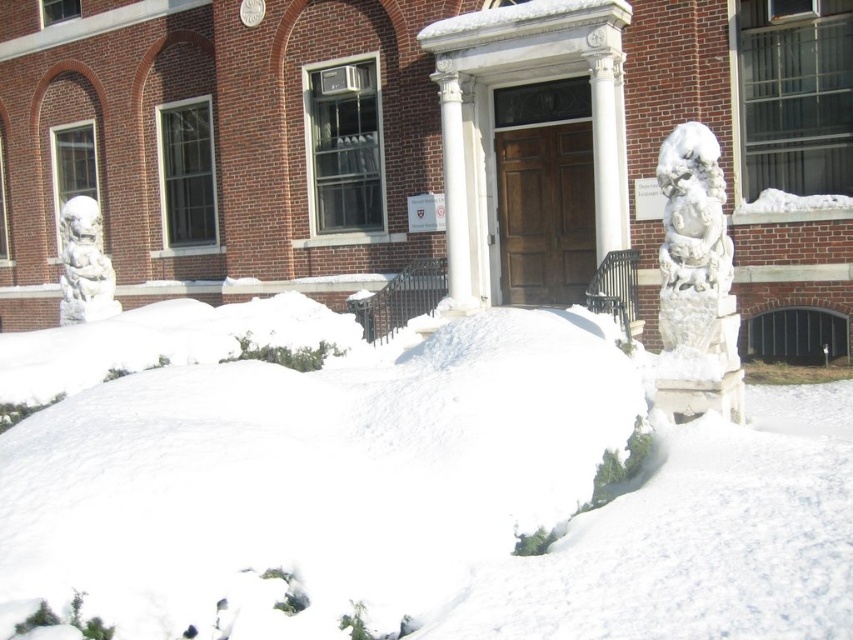
You are standing in front of the brick building and want to locate two points marked in the image. Which point is closer to you, point (718, 321) or point (82, 294)?

Point (718, 321) is closer to the viewer than point (82, 294).